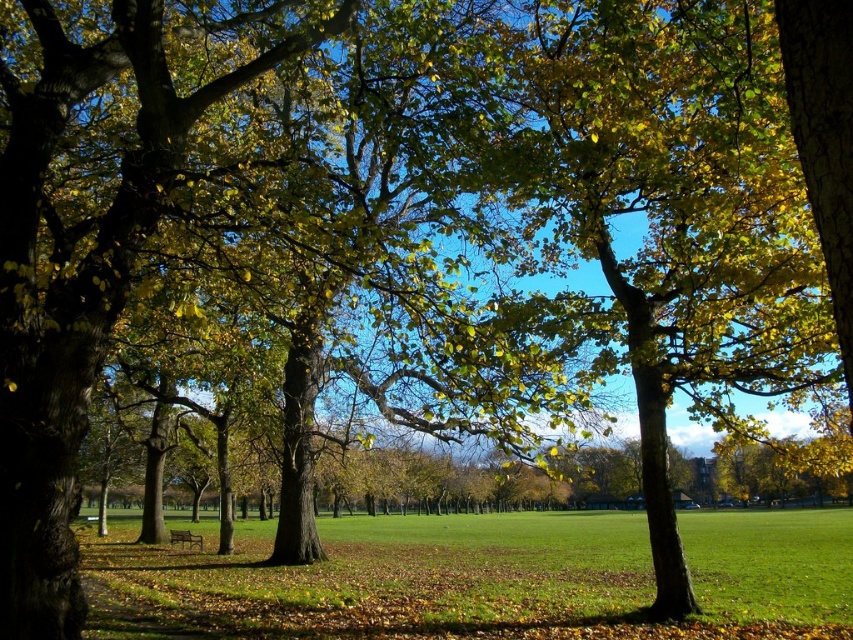
From the picture: You are standing at the point marked by the coordinates point (479, 579) in the park scene. What is the immediate surface you are standing on?

The point (479, 579) indicates green grassy field at center, so you are standing on the green grassy field at center.

You are planning to set up a picnic in the park and have a picnic blanket that is 2 meters wide. You see the green grassy field at center and the wooden bench at center. Which area should you place your picnic blanket to ensure it fits entirely without overlapping the bench?

The green grassy field at center is taller than the wooden bench at center, so placing the picnic blanket on the green grassy field at center would ensure it fits entirely without overlapping the bench.

You are standing in the park and want to sit down. You see the green grassy field at center and the wooden bench at center. Which one is closer to the ground?

The green grassy field at center is located below the wooden bench at center, so the green grassy field at center is closer to the ground.